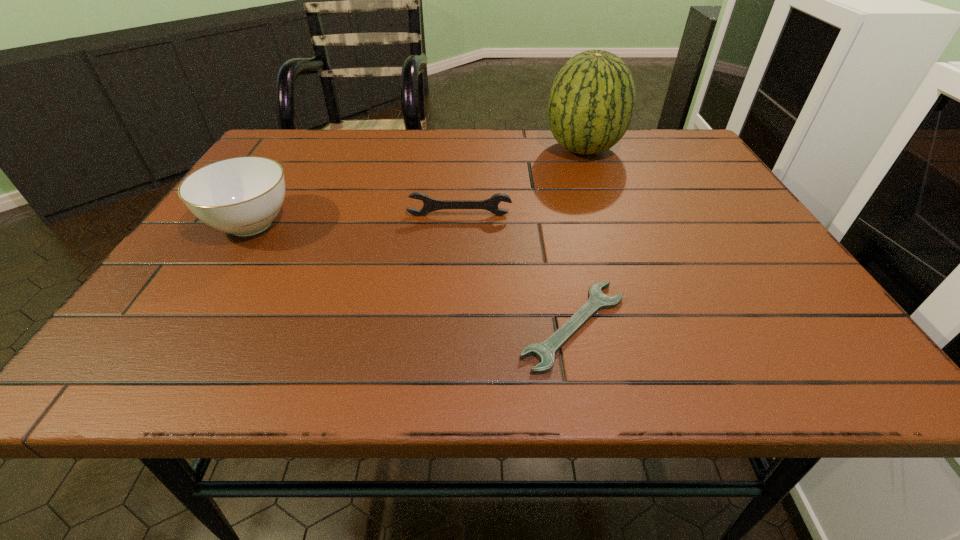
Find the location of a particular element. vacant space in between the chinaware and the third tallest object is located at coordinates (355, 219).

Image resolution: width=960 pixels, height=540 pixels. I want to click on object identified as the second closest to the watermelon, so click(x=544, y=351).

Find the location of a particular element. The image size is (960, 540). object that stands as the second closest to the leftmost object is located at coordinates (544, 351).

Where is `vacant space that satisfies the following two spatial constraints: 1. on the open ends of the taller wrench; 2. on the left side of the nearest object`? Image resolution: width=960 pixels, height=540 pixels. vacant space that satisfies the following two spatial constraints: 1. on the open ends of the taller wrench; 2. on the left side of the nearest object is located at coordinates (452, 326).